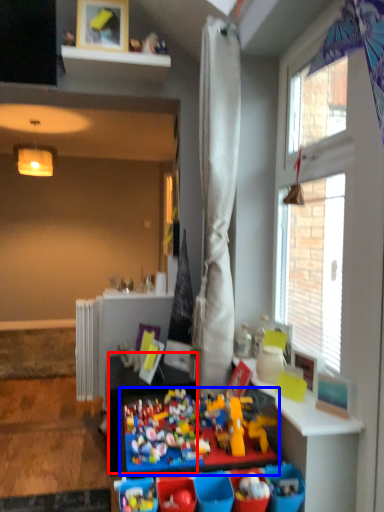
Question: Which object appears closest to the camera in this image, table (highlighted by a red box) or toy (highlighted by a blue box)?

Choices:
 (A) table
 (B) toy

Answer: (B)